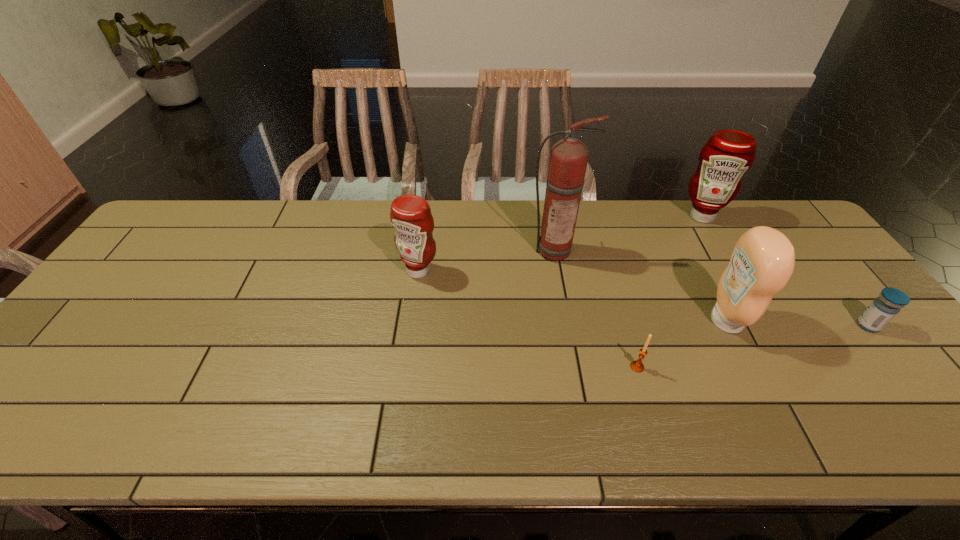
The height and width of the screenshot is (540, 960). In order to click on vacant region at the far edge of the desktop in this screenshot , I will do `click(727, 209)`.

This screenshot has height=540, width=960. I want to click on free region at the near edge, so click(x=266, y=438).

At what (x,y) coordinates should I click in order to perform the action: click on free space at the left edge of the desktop. Please return your answer as a coordinate pair (x, y). This screenshot has height=540, width=960. Looking at the image, I should click on (152, 265).

Identify the location of vacant area at the right edge of the desktop. (877, 395).

The height and width of the screenshot is (540, 960). Find the location of `vacant space at the far right corner of the desktop`. vacant space at the far right corner of the desktop is located at coordinates (775, 200).

Identify the location of free space between the nearest condiment and the fourth object from right to left. The image size is (960, 540). (682, 343).

You are a GUI agent. You are given a task and a screenshot of the screen. Output one action in this format:
    pyautogui.click(x=<x>, y=<y>)
    Task: Click on the free spot between the farthest condiment and the nearest condiment
    
    Given the screenshot: What is the action you would take?
    click(x=713, y=268)

At what (x,y) coordinates should I click in order to perform the action: click on empty space that is in between the medicine and the tallest object. Please return your answer as a coordinate pair (x, y). Looking at the image, I should click on (710, 288).

The width and height of the screenshot is (960, 540). I want to click on free space between the nearest object and the tallest object, so click(x=595, y=308).

Find the location of a particular element. empty space between the leftmost condiment and the candle_holder is located at coordinates (528, 319).